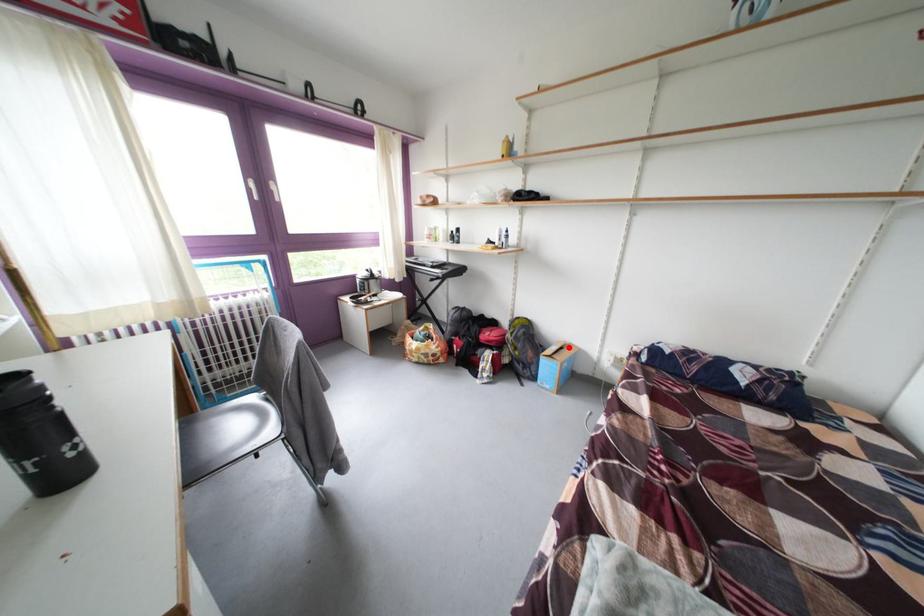
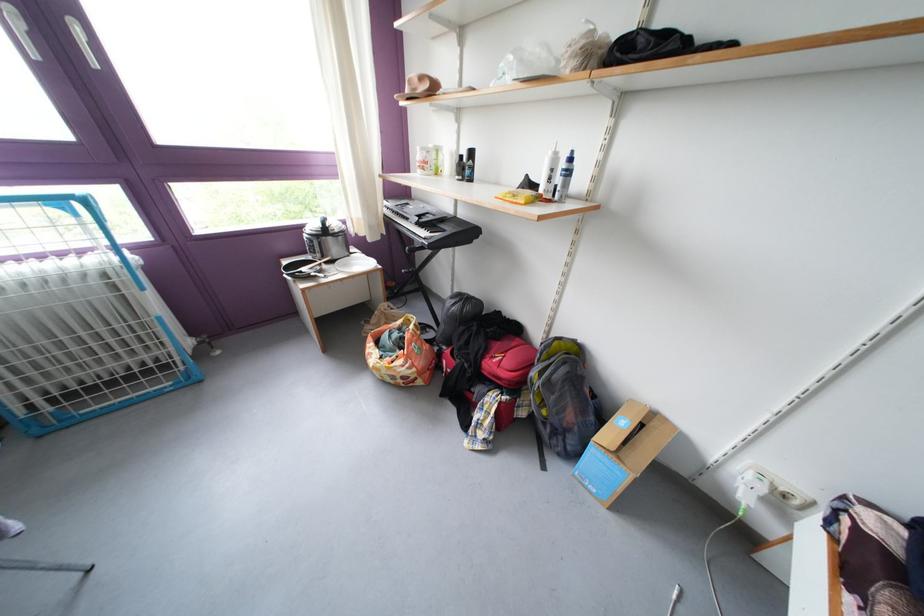
Locate, in the second image, the point that corresponds to the highlighted location in the first image.

(641, 407)